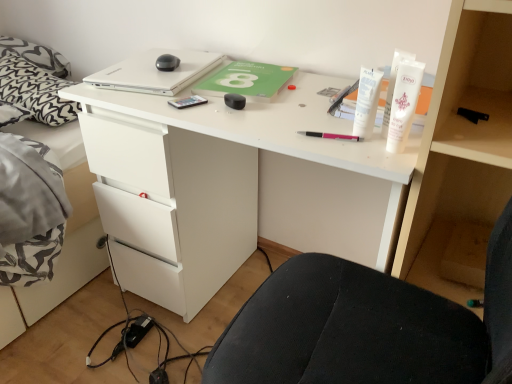
Question: Is white matte tube at upper right, the second toiletry viewed from the right, wider than black rubberized mouse at center, which is counted as the second stationery, starting from the back?

Choices:
 (A) no
 (B) yes

Answer: (A)

Question: Does white matte tube at upper right, the second toiletry viewed from the right, come in front of black rubberized mouse at center, arranged as the 3th stationery when viewed from the right?

Choices:
 (A) no
 (B) yes

Answer: (B)

Question: Does white matte tube at upper right, the 1th toiletry in the left-to-right sequence, have a larger size compared to black rubberized mouse at center, the 3th stationery in the front-to-back sequence?

Choices:
 (A) yes
 (B) no

Answer: (A)

Question: From the image's perspective, is white matte tube at upper right, the second toiletry viewed from the right, below black rubberized mouse at center, which is counted as the second stationery, starting from the back?

Choices:
 (A) yes
 (B) no

Answer: (A)

Question: Can you confirm if white matte tube at upper right, the second toiletry viewed from the right, is shorter than black rubberized mouse at center, the 3th stationery in the front-to-back sequence?

Choices:
 (A) no
 (B) yes

Answer: (A)

Question: Is black rubberized mouse at center, the 3th stationery in the front-to-back sequence, bigger or smaller than pink plastic pen at center, acting as the 3th stationery starting from the back?

Choices:
 (A) small
 (B) big

Answer: (B)

Question: From the image's perspective, is black rubberized mouse at center, which is counted as the second stationery, starting from the back, above or below pink plastic pen at center, acting as the 3th stationery starting from the back?

Choices:
 (A) above
 (B) below

Answer: (A)

Question: In terms of height, does black rubberized mouse at center, arranged as the 3th stationery when viewed from the right, look taller or shorter compared to pink plastic pen at center, the second stationery when ordered from front to back?

Choices:
 (A) short
 (B) tall

Answer: (B)

Question: Based on their positions, is black rubberized mouse at center, which is counted as the second stationery, starting from the back, located to the left or right of pink plastic pen at center, acting as the 3th stationery starting from the back?

Choices:
 (A) right
 (B) left

Answer: (B)

Question: Is black rubberized mouse at center, the 2th stationery in the left-to-right sequence, taller or shorter than white matte laptop at upper center?

Choices:
 (A) tall
 (B) short

Answer: (A)

Question: Is black rubberized mouse at center, which is counted as the second stationery, starting from the back, inside the boundaries of white matte laptop at upper center, or outside?

Choices:
 (A) inside
 (B) outside

Answer: (B)

Question: From a real-world perspective, is black rubberized mouse at center, which is counted as the second stationery, starting from the back, above or below white matte laptop at upper center?

Choices:
 (A) above
 (B) below

Answer: (B)

Question: Does point [239, 105] appear closer or farther from the camera than point [179, 82]?

Choices:
 (A) farther
 (B) closer

Answer: (B)

Question: Is black plastic pen at upper right, which is the 4th stationery in left-to-right order, wider or thinner than white matte tube at upper right, arranged as the second toiletry when viewed from the left?

Choices:
 (A) wide
 (B) thin

Answer: (A)

Question: From the image's perspective, is black plastic pen at upper right, placed as the fourth stationery when sorted from back to front, above or below white matte tube at upper right, arranged as the second toiletry when viewed from the left?

Choices:
 (A) above
 (B) below

Answer: (B)